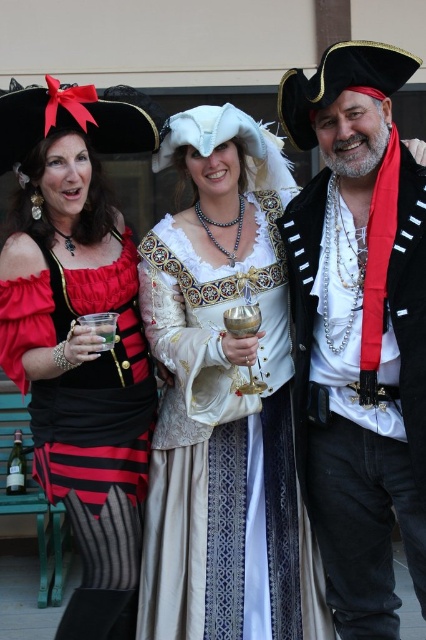
Question: Among these points, which one is nearest to the camera?

Choices:
 (A) (396, 83)
 (B) (62, 125)
 (C) (293, 563)

Answer: (A)

Question: Among these objects, which one is nearest to the camera?

Choices:
 (A) matte black pirate hat at upper left
 (B) shiny black pirate hat at right

Answer: (B)

Question: Where is white satin dress at center located in relation to matte black pirate hat at upper left in the image?

Choices:
 (A) above
 (B) below

Answer: (B)

Question: Can you confirm if shiny black pirate hat at right is positioned above matte black pirate hat at upper left?

Choices:
 (A) no
 (B) yes

Answer: (B)

Question: Which point is farther to the camera?

Choices:
 (A) shiny black pirate hat at right
 (B) white satin dress at center

Answer: (B)

Question: Does shiny black pirate hat at right appear on the left side of matte black pirate hat at upper left?

Choices:
 (A) no
 (B) yes

Answer: (A)